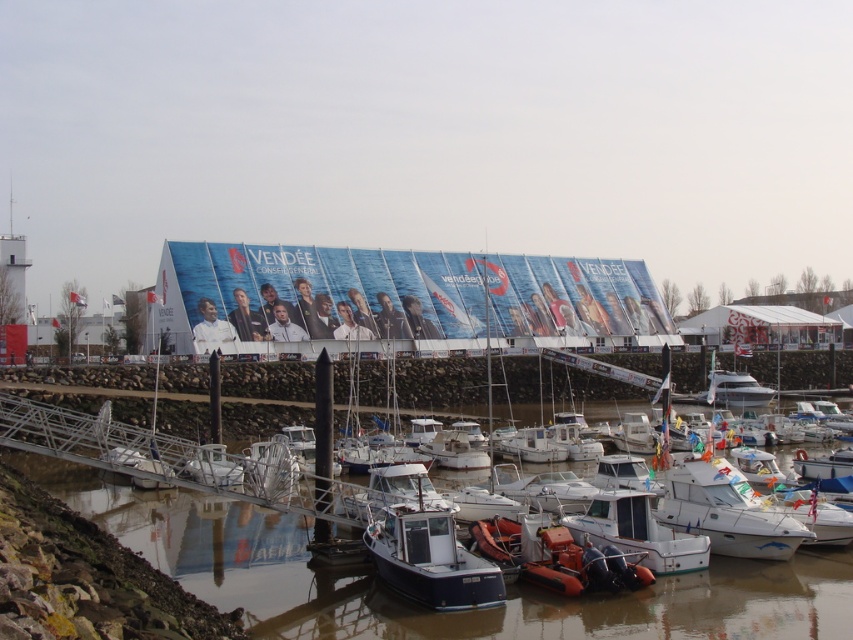
Who is lower down, blue fabric banner at center or blue matte boat at center?

blue matte boat at center

Is blue fabric banner at center in front of blue matte boat at center?

That is False.

The height and width of the screenshot is (640, 853). What are the coordinates of `blue fabric banner at center` in the screenshot? It's located at (397, 296).

Image resolution: width=853 pixels, height=640 pixels. I want to click on blue fabric banner at center, so click(x=397, y=296).

Between point (531, 621) and point (402, 298), which one is positioned in front?

Point (531, 621) is more forward.

Is smooth water at lower center further to camera compared to blue fabric banner at center?

No, it is not.

Between point (822, 628) and point (444, 292), which one is positioned behind?

The point (444, 292) is behind.

I want to click on smooth water at lower center, so [x=422, y=609].

Who is higher up, smooth water at lower center or white matte boat at center?

white matte boat at center

Does point (169, 493) come in front of point (589, 506)?

That is False.

Does point (323, 618) come behind point (601, 536)?

No, (323, 618) is closer to viewer.

Locate an element on the screen. smooth water at lower center is located at coordinates (422, 609).